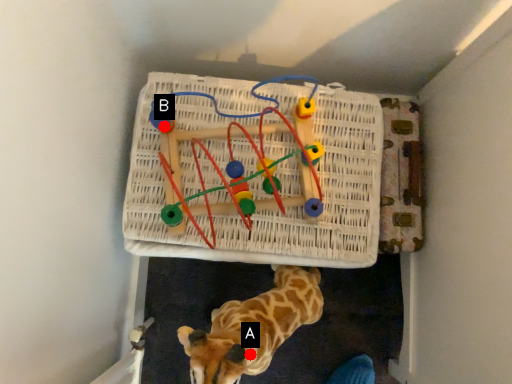
Question: Two points are circled on the image, labeled by A and B beside each circle. Which point is closer to the camera?

Choices:
 (A) A is closer
 (B) B is closer

Answer: (A)